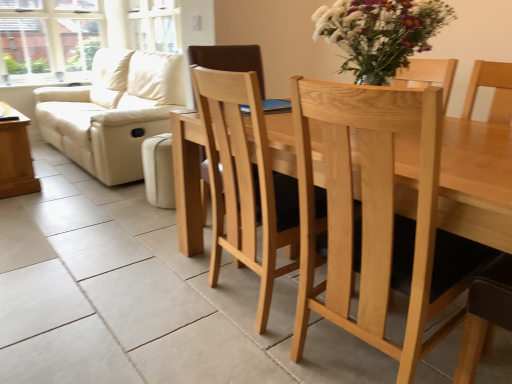
Question: Is clear glass window at upper left positioned with its back to natural wood chair at center?

Choices:
 (A) yes
 (B) no

Answer: (B)

Question: Can you confirm if clear glass window at upper left is bigger than natural wood chair at center?

Choices:
 (A) yes
 (B) no

Answer: (B)

Question: Are clear glass window at upper left and natural wood chair at center beside each other?

Choices:
 (A) yes
 (B) no

Answer: (B)

Question: Is clear glass window at upper left at the right side of natural wood chair at center?

Choices:
 (A) yes
 (B) no

Answer: (B)

Question: Does clear glass window at upper left have a lesser height compared to natural wood chair at center?

Choices:
 (A) no
 (B) yes

Answer: (B)

Question: Based on their sizes in the image, would you say wooden side table at left is bigger or smaller than beige leather couch at left?

Choices:
 (A) big
 (B) small

Answer: (B)

Question: Would you say wooden side table at left is to the left or to the right of beige leather couch at left in the picture?

Choices:
 (A) right
 (B) left

Answer: (B)

Question: Considering the positions of point (2, 142) and point (53, 97), is point (2, 142) closer or farther from the camera than point (53, 97)?

Choices:
 (A) closer
 (B) farther

Answer: (A)

Question: From their relative heights in the image, would you say wooden side table at left is taller or shorter than beige leather couch at left?

Choices:
 (A) short
 (B) tall

Answer: (A)

Question: In the image, is clear glass window at upper left positioned in front of or behind beige leather couch at left?

Choices:
 (A) behind
 (B) front

Answer: (A)

Question: Visually, is clear glass window at upper left positioned to the left or to the right of beige leather couch at left?

Choices:
 (A) right
 (B) left

Answer: (B)

Question: Considering the positions of clear glass window at upper left and beige leather couch at left in the image, is clear glass window at upper left taller or shorter than beige leather couch at left?

Choices:
 (A) tall
 (B) short

Answer: (B)

Question: From a real-world perspective, relative to beige leather couch at left, is clear glass window at upper left vertically above or below?

Choices:
 (A) above
 (B) below

Answer: (A)

Question: From a real-world perspective, is clear glass window at upper left positioned above or below natural wood chair at center?

Choices:
 (A) below
 (B) above

Answer: (B)

Question: Is clear glass window at upper left to the left or to the right of natural wood chair at center in the image?

Choices:
 (A) left
 (B) right

Answer: (A)